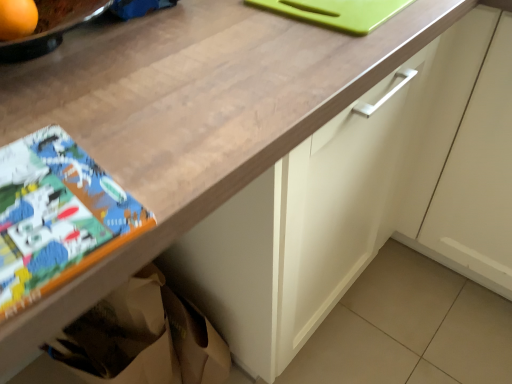
Question: Is orange matte at upper left oriented away from matte paper comic book at lower left?

Choices:
 (A) no
 (B) yes

Answer: (A)

Question: Can you confirm if orange matte at upper left is wider than matte paper comic book at lower left?

Choices:
 (A) no
 (B) yes

Answer: (A)

Question: Does orange matte at upper left have a smaller size compared to matte paper comic book at lower left?

Choices:
 (A) yes
 (B) no

Answer: (A)

Question: Is orange matte at upper left next to matte paper comic book at lower left?

Choices:
 (A) yes
 (B) no

Answer: (B)

Question: Is orange matte at upper left closer to camera compared to matte paper comic book at lower left?

Choices:
 (A) yes
 (B) no

Answer: (B)

Question: From a real-world perspective, is orange matte at upper left located higher than matte paper comic book at lower left?

Choices:
 (A) no
 (B) yes

Answer: (B)

Question: Is orange matte at upper left not inside white matte cabinet at center?

Choices:
 (A) no
 (B) yes

Answer: (B)

Question: Can you confirm if orange matte at upper left is taller than white matte cabinet at center?

Choices:
 (A) no
 (B) yes

Answer: (A)

Question: From a real-world perspective, is orange matte at upper left physically above white matte cabinet at center?

Choices:
 (A) no
 (B) yes

Answer: (B)

Question: Can you confirm if orange matte at upper left is thinner than white matte cabinet at center?

Choices:
 (A) no
 (B) yes

Answer: (B)

Question: Can you confirm if orange matte at upper left is positioned to the left of white matte cabinet at center?

Choices:
 (A) no
 (B) yes

Answer: (B)

Question: Does orange matte at upper left have a smaller size compared to white matte cabinet at center?

Choices:
 (A) no
 (B) yes

Answer: (B)

Question: From the image's perspective, would you say matte paper comic book at lower left is shown under white matte cabinet at center?

Choices:
 (A) no
 (B) yes

Answer: (B)